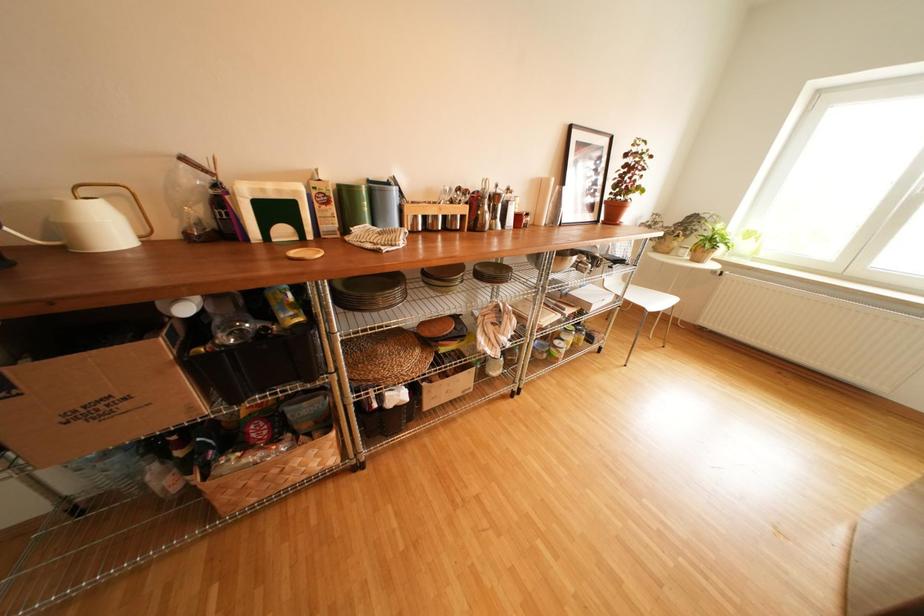
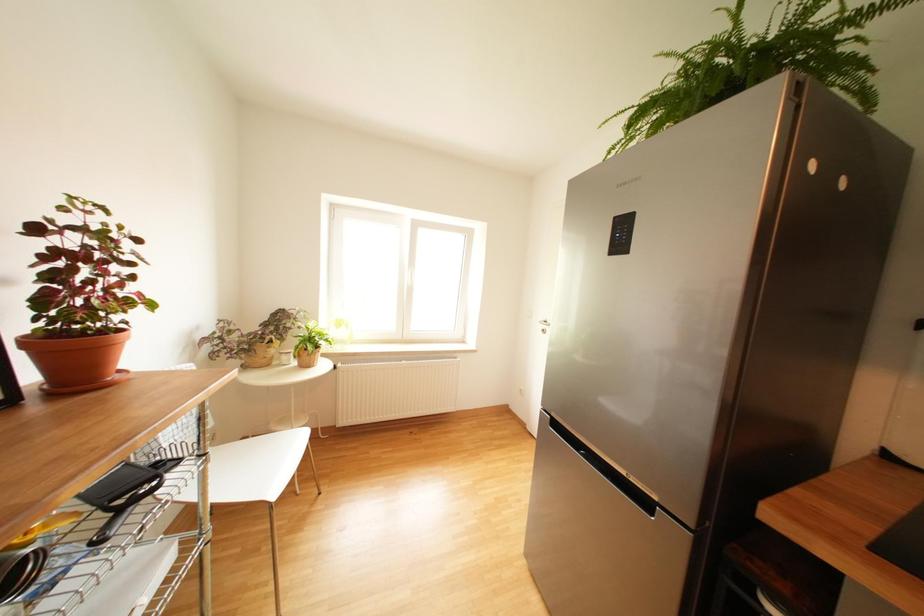
Question: The images are taken continuously from a first-person perspective. In which direction is your viewpoint rotating?

Choices:
 (A) Left
 (B) Right
 (C) Up
 (D) Down

Answer: (B)